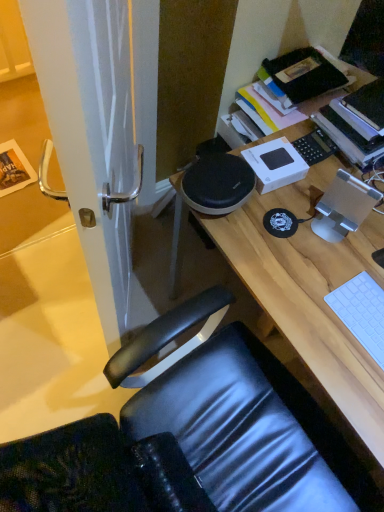
The height and width of the screenshot is (512, 384). In order to click on vacant space underneath white matte keyboard at lower right (from a real-world perspective) in this screenshot , I will do `click(364, 321)`.